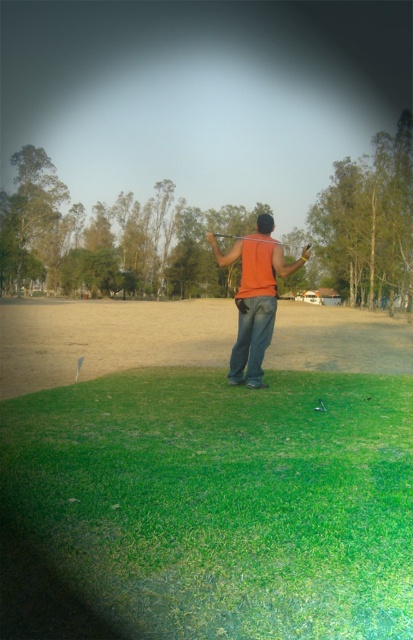
Is green grassy field at lower center taller than orange fabric shirt at center?

No, green grassy field at lower center is not taller than orange fabric shirt at center.

From the picture: Who is more distant from viewer, [121,541] or [261,252]?

The point [261,252] is more distant.

In order to click on green grassy field at lower center in this screenshot , I will do pos(208,508).

This screenshot has height=640, width=413. What are the coordinates of `green grassy field at lower center` in the screenshot? It's located at (208, 508).

Is green grassy field at lower center to the right of brown sandy dirt field at center from the viewer's perspective?

Indeed, green grassy field at lower center is positioned on the right side of brown sandy dirt field at center.

Is green grassy field at lower center bigger than brown sandy dirt field at center?

Incorrect, green grassy field at lower center is not larger than brown sandy dirt field at center.

Between point (106, 541) and point (206, 337), which one is positioned in front?

Point (106, 541) is more forward.

Locate an element on the screen. The height and width of the screenshot is (640, 413). green grassy field at lower center is located at coordinates (208, 508).

Consider the image. Which is above, brown sandy dirt field at center or orange fabric shirt at center?

brown sandy dirt field at center

Is brown sandy dirt field at center positioned in front of orange fabric shirt at center?

No, brown sandy dirt field at center is further to the viewer.

Does point (327, 349) come in front of point (234, 348)?

No, it is not.

Identify the location of brown sandy dirt field at center. This screenshot has height=640, width=413. (108, 339).